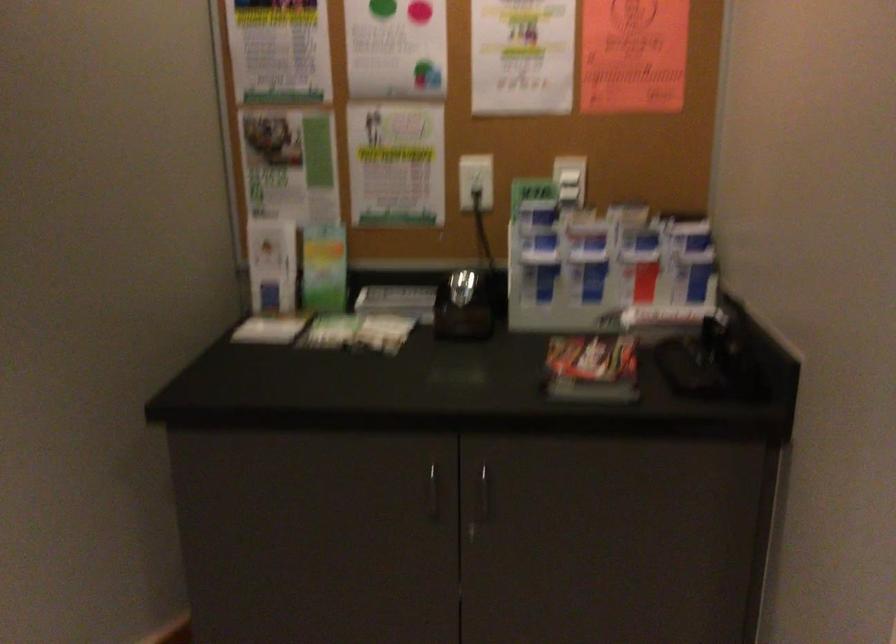
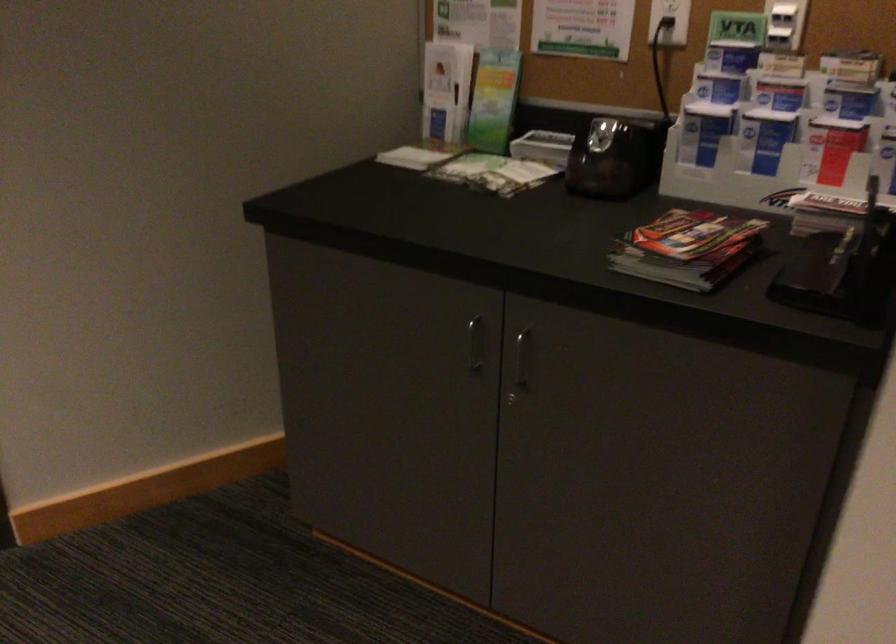
Where in the second image is the point corresponding to (x=591, y=272) from the first image?

(764, 138)